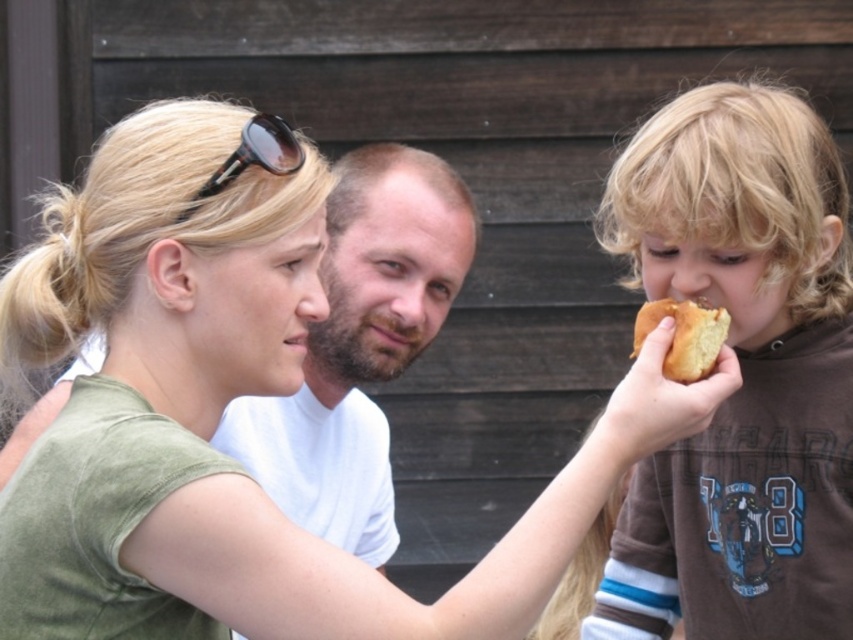
Question: Among these points, which one is nearest to the camera?

Choices:
 (A) (x=329, y=628)
 (B) (x=708, y=368)
 (C) (x=836, y=500)

Answer: (A)

Question: Can you confirm if matte green shirt at center is smaller than black plastic sunglasses at upper center?

Choices:
 (A) no
 (B) yes

Answer: (A)

Question: Is matte green shirt at center positioned behind black plastic sunglasses at upper center?

Choices:
 (A) no
 (B) yes

Answer: (A)

Question: Which is nearer to the black plastic sunglasses at upper center?

Choices:
 (A) golden bread at right
 (B) matte green shirt at center
 (C) brown soft bread at right

Answer: (B)

Question: Can you confirm if matte green shirt at center is smaller than black plastic sunglasses at upper center?

Choices:
 (A) no
 (B) yes

Answer: (A)

Question: Estimate the real-world distances between objects in this image. Which object is farther from the matte green shirt at center?

Choices:
 (A) brown soft bread at right
 (B) golden bread at right

Answer: (B)